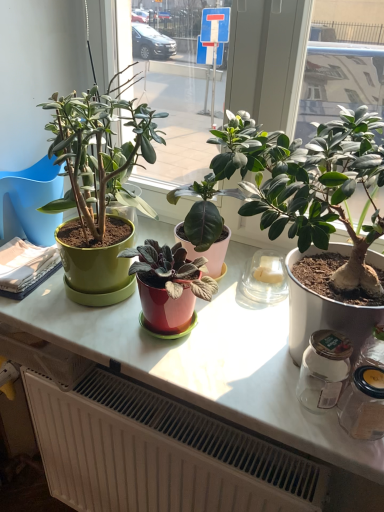
Question: Could you tell me if matte green pot at left is turned towards green matte plant pot at left, marked as the 2th houseplant in a right-to-left arrangement?

Choices:
 (A) no
 (B) yes

Answer: (A)

Question: Is green matte plant pot at left, marked as the 2th houseplant in a right-to-left arrangement, a part of matte green pot at left?

Choices:
 (A) no
 (B) yes

Answer: (A)

Question: Does matte green pot at left appear on the right side of green matte plant pot at left, which is counted as the 1th houseplant, starting from the left?

Choices:
 (A) yes
 (B) no

Answer: (B)

Question: Does matte green pot at left have a greater width compared to green matte plant pot at left, which is counted as the 1th houseplant, starting from the left?

Choices:
 (A) no
 (B) yes

Answer: (A)

Question: Is matte green pot at left next to green matte plant pot at left, which is counted as the 1th houseplant, starting from the left?

Choices:
 (A) yes
 (B) no

Answer: (B)

Question: Is matte green pot at left outside green matte plant pot at left, which is counted as the 1th houseplant, starting from the left?

Choices:
 (A) no
 (B) yes

Answer: (B)

Question: Is the position of green matte plant pot at left, marked as the 2th houseplant in a right-to-left arrangement, more distant than that of white matte radiator at lower center?

Choices:
 (A) no
 (B) yes

Answer: (A)

Question: Does green matte plant pot at left, which is counted as the 1th houseplant, starting from the left, turn towards white matte radiator at lower center?

Choices:
 (A) no
 (B) yes

Answer: (A)

Question: From the image's perspective, is green matte plant pot at left, which is counted as the 1th houseplant, starting from the left, beneath white matte radiator at lower center?

Choices:
 (A) no
 (B) yes

Answer: (A)

Question: Does green matte plant pot at left, marked as the 2th houseplant in a right-to-left arrangement, have a lesser width compared to white matte radiator at lower center?

Choices:
 (A) no
 (B) yes

Answer: (A)

Question: From a real-world perspective, is green matte plant pot at left, which is counted as the 1th houseplant, starting from the left, over white matte radiator at lower center?

Choices:
 (A) no
 (B) yes

Answer: (B)

Question: Is green matte plant pot at left, marked as the 2th houseplant in a right-to-left arrangement, to the left of white matte radiator at lower center from the viewer's perspective?

Choices:
 (A) no
 (B) yes

Answer: (B)

Question: Considering the relative sizes of green matte plant pot at left, marked as the 2th houseplant in a right-to-left arrangement, and matte green plant at center, the 1th houseplant viewed from the right, in the image provided, is green matte plant pot at left, marked as the 2th houseplant in a right-to-left arrangement, wider than matte green plant at center, the 1th houseplant viewed from the right,?

Choices:
 (A) no
 (B) yes

Answer: (B)